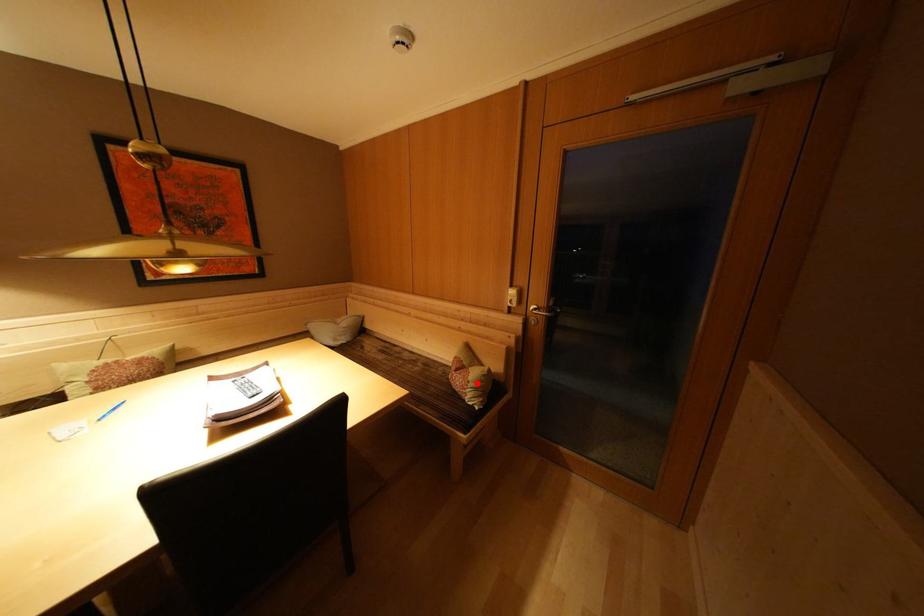
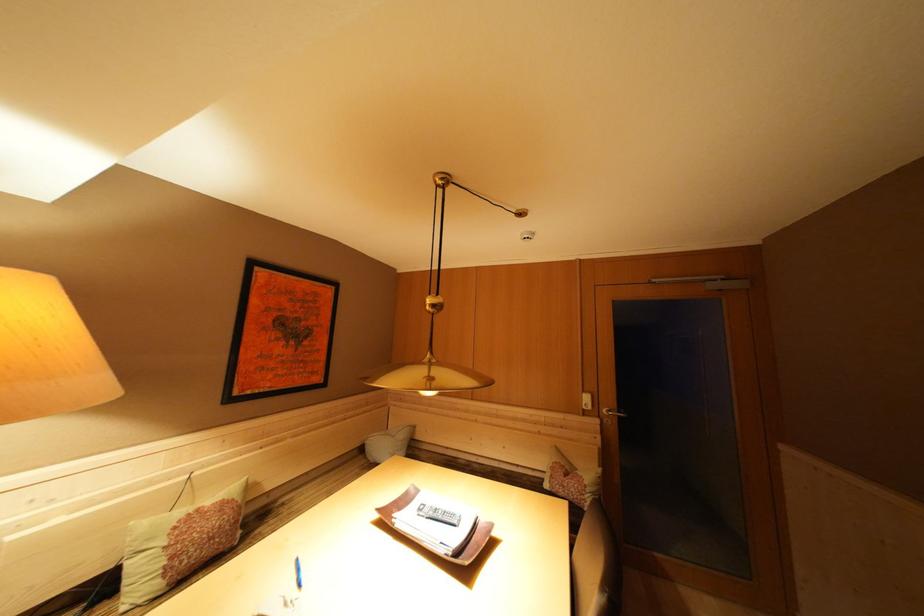
Where in the second image is the point corresponding to the highlighted location from the first image?

(592, 487)